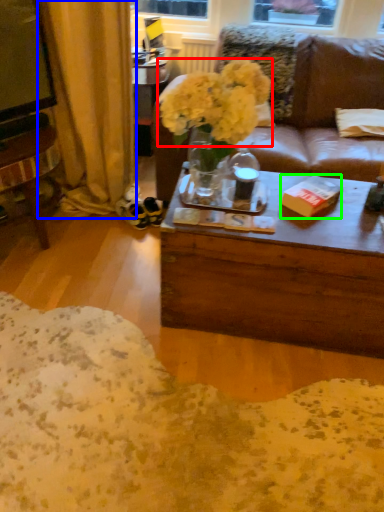
Question: Which is farther away from flower (highlighted by a red box)? curtain (highlighted by a blue box) or book (highlighted by a green box)?

Choices:
 (A) curtain
 (B) book

Answer: (A)